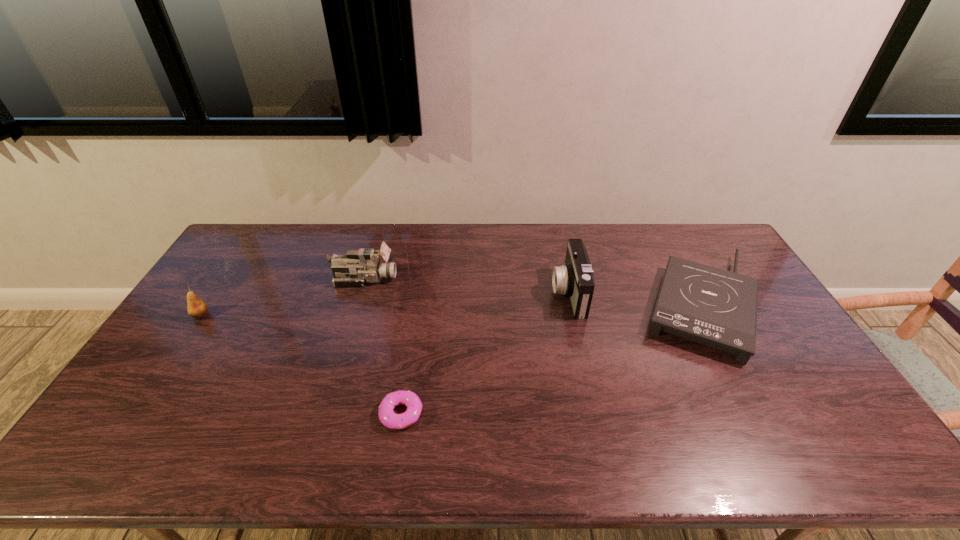
Image resolution: width=960 pixels, height=540 pixels. Find the location of `free area in between the fourth object from left to right and the pear`. free area in between the fourth object from left to right and the pear is located at coordinates (385, 304).

Locate an element on the screen. This screenshot has height=540, width=960. vacant space in between the right camcorder and the third shortest object is located at coordinates (385, 304).

Where is `free space between the left camcorder and the hotplate`? free space between the left camcorder and the hotplate is located at coordinates (533, 292).

Locate which object ranks second in proximity to the second object from right to left. Please provide its 2D coordinates. Your answer should be formatted as a tuple, i.e. [(x, y)], where the tuple contains the x and y coordinates of a point satisfying the conditions above.

[(387, 416)]

Identify which object is the fourth nearest to the hotplate. Please provide its 2D coordinates. Your answer should be formatted as a tuple, i.e. [(x, y)], where the tuple contains the x and y coordinates of a point satisfying the conditions above.

[(196, 308)]

You are a GUI agent. You are given a task and a screenshot of the screen. Output one action in this format:
    pyautogui.click(x=<x>, y=<y>)
    Task: Click on the vacant space that satisfies the following two spatial constraints: 1. on the back side of the third shortest object; 2. on the right side of the rightmost object
    The width and height of the screenshot is (960, 540).
    Given the screenshot: What is the action you would take?
    pyautogui.click(x=207, y=305)

Where is `free space that satisfies the following two spatial constraints: 1. on the front-facing side of the fourth object from right to left; 2. on the back side of the doughnut`? Image resolution: width=960 pixels, height=540 pixels. free space that satisfies the following two spatial constraints: 1. on the front-facing side of the fourth object from right to left; 2. on the back side of the doughnut is located at coordinates (324, 414).

Find the location of a particular element. vacant region that satisfies the following two spatial constraints: 1. on the lens of the fourth object from left to right; 2. on the right side of the rightmost object is located at coordinates (571, 305).

This screenshot has width=960, height=540. Identify the location of free space that satisfies the following two spatial constraints: 1. on the front-facing side of the rightmost object; 2. on the right side of the left camcorder. (357, 305).